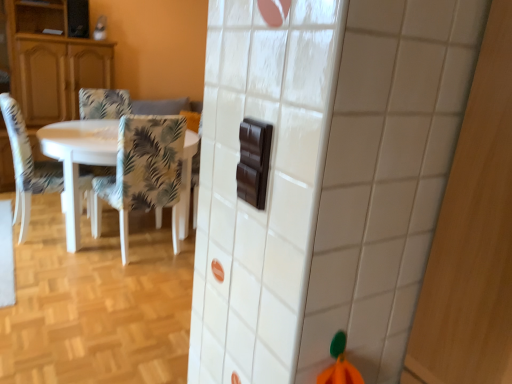
Question: Is floral fabric chair at left, placed as the 2th chair when sorted from left to right, taller than patterned fabric chair at left, the third chair viewed from the left?

Choices:
 (A) no
 (B) yes

Answer: (A)

Question: Would you consider floral fabric chair at left, the 2th chair in the right-to-left sequence, to be distant from patterned fabric chair at left, the third chair viewed from the left?

Choices:
 (A) no
 (B) yes

Answer: (B)

Question: Does floral fabric chair at left, placed as the 2th chair when sorted from left to right, appear on the right side of patterned fabric chair at left, acting as the first chair starting from the right?

Choices:
 (A) no
 (B) yes

Answer: (A)

Question: Is patterned fabric chair at left, the third chair viewed from the left, located within floral fabric chair at left, the 2th chair in the right-to-left sequence?

Choices:
 (A) no
 (B) yes

Answer: (A)

Question: Can you see floral fabric chair at left, placed as the 2th chair when sorted from left to right, touching patterned fabric chair at left, the third chair viewed from the left?

Choices:
 (A) yes
 (B) no

Answer: (B)

Question: From the image's perspective, is matte wood cabinet at left above or below white glossy table at left?

Choices:
 (A) above
 (B) below

Answer: (A)

Question: In terms of width, does matte wood cabinet at left look wider or thinner when compared to white glossy table at left?

Choices:
 (A) thin
 (B) wide

Answer: (A)

Question: Is matte wood cabinet at left inside or outside of white glossy table at left?

Choices:
 (A) inside
 (B) outside

Answer: (B)

Question: In terms of height, does matte wood cabinet at left look taller or shorter compared to white glossy table at left?

Choices:
 (A) tall
 (B) short

Answer: (A)

Question: From a real-world perspective, is white glossy table at left above or below floral fabric chair at left, placed as the 2th chair when sorted from left to right?

Choices:
 (A) below
 (B) above

Answer: (A)

Question: Would you say white glossy table at left is inside or outside floral fabric chair at left, the 2th chair in the right-to-left sequence?

Choices:
 (A) inside
 (B) outside

Answer: (B)

Question: In terms of width, does white glossy table at left look wider or thinner when compared to floral fabric chair at left, the 2th chair in the right-to-left sequence?

Choices:
 (A) thin
 (B) wide

Answer: (B)

Question: Considering the positions of point (30, 195) and point (159, 213), is point (30, 195) closer or farther from the camera than point (159, 213)?

Choices:
 (A) closer
 (B) farther

Answer: (A)

Question: Visually, is floral fabric chair at left, the 2th chair in the right-to-left sequence, positioned to the left or to the right of matte wood cabinet at left?

Choices:
 (A) right
 (B) left

Answer: (A)

Question: From their relative heights in the image, would you say floral fabric chair at left, the 2th chair in the right-to-left sequence, is taller or shorter than matte wood cabinet at left?

Choices:
 (A) short
 (B) tall

Answer: (A)